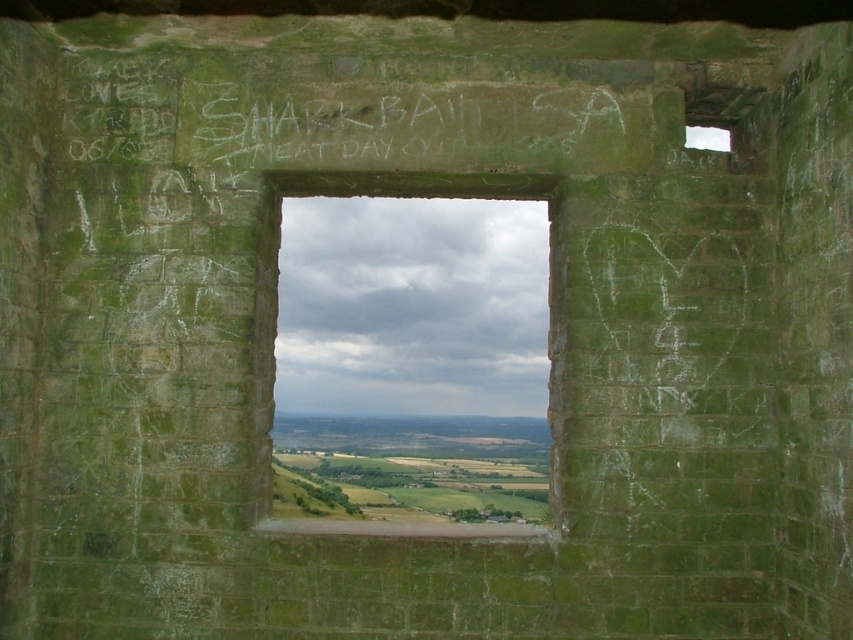
You are an architect designing a new historical building and want to place a window in the same position as the green stone window at center. What are the coordinates for the center of the window?

The coordinates for the center of the green stone window at center are at point [413,307].

You are an art restorer examining the green stone window at center and the white chalk graffiti at center. Which object is positioned higher in the scene?

The white chalk graffiti at center is positioned higher than the green stone window at center because the green stone window at center is located below it.